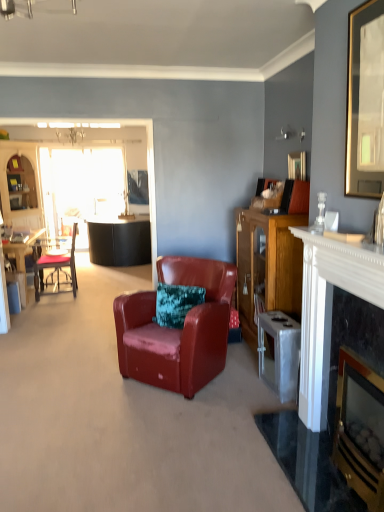
Image resolution: width=384 pixels, height=512 pixels. I want to click on unoccupied area in front of leather armchair at center, acting as the 1th chair starting from the right, so click(162, 432).